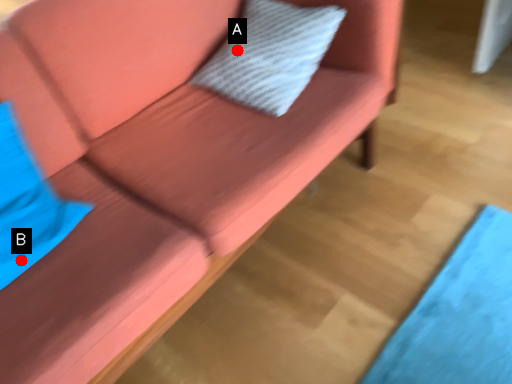
Question: Two points are circled on the image, labeled by A and B beside each circle. Which point appears closest to the camera in this image?

Choices:
 (A) A is closer
 (B) B is closer

Answer: (B)